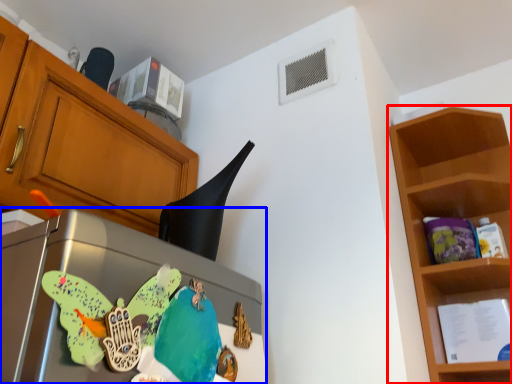
Question: Which object appears farthest to the camera in this image, shelf (highlighted by a red box) or appliance (highlighted by a blue box)?

Choices:
 (A) shelf
 (B) appliance

Answer: (A)